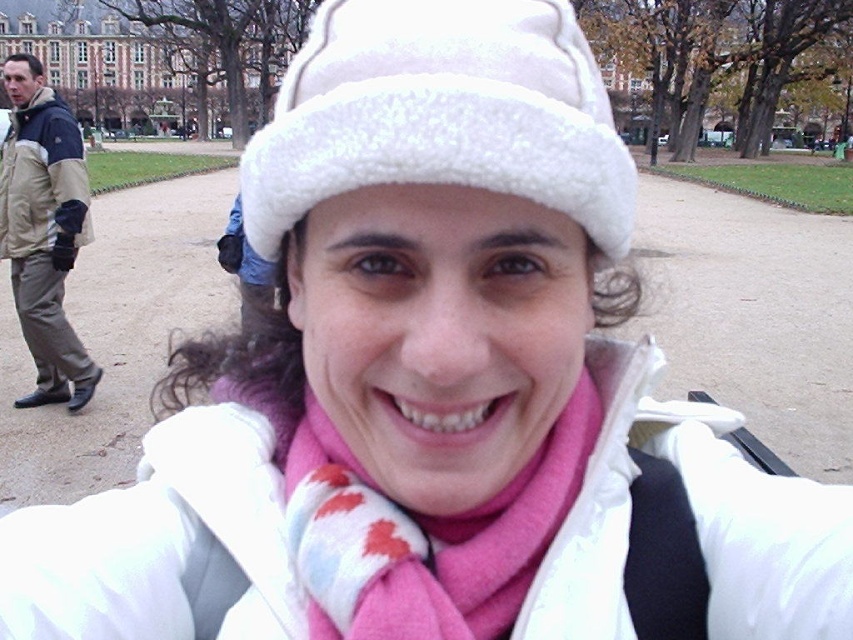
You are standing in the park and want to take a photo of the pink soft scarf at center. Where should you position yourself to capture it in the frame?

The pink soft scarf at center is located at point (425, 536), so you should position yourself directly in front of that coordinate to capture it in the frame.

You are a photographer trying to capture a clear shot of the pink soft scarf at center and the khaki cotton pants at left. Which one should you focus on first to ensure it appears sharp in the photo?

The pink soft scarf at center is closer to the viewer than the khaki cotton pants at left, so you should focus on the pink soft scarf at center first to ensure it appears sharp in the photo.

You are standing in the park and see the pink soft scarf at center and the khaki cotton pants at left. Which item is positioned lower in the image?

The pink soft scarf at center is positioned below the khaki cotton pants at left, so it is lower in the image.